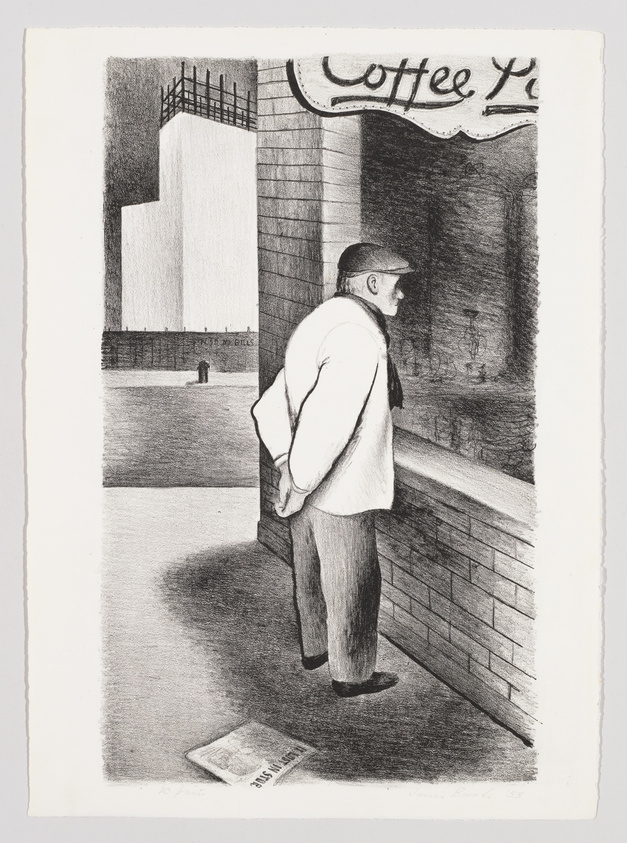
Image resolution: width=627 pixels, height=843 pixels. I want to click on newspaper, so click(x=241, y=745).